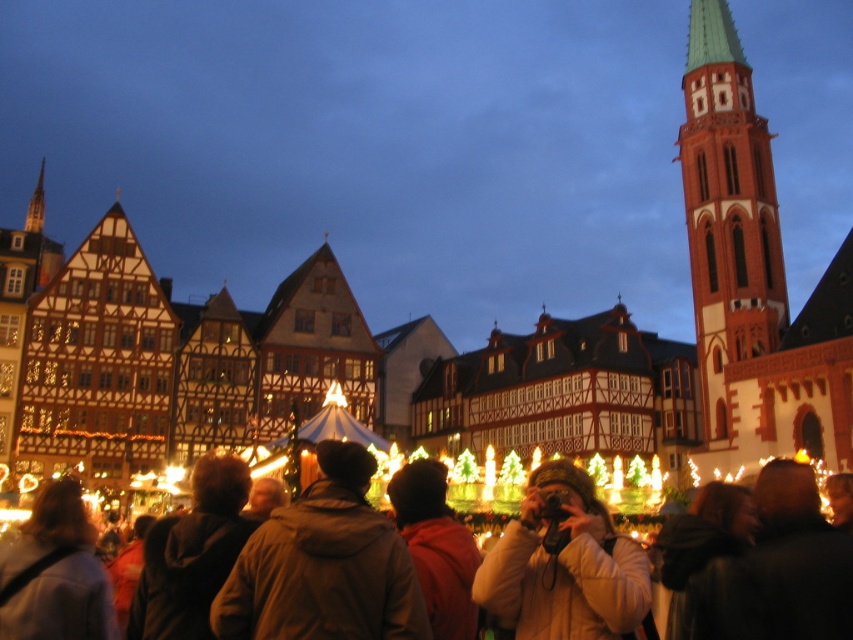
Question: Can you confirm if brown leather jacket at lower left is positioned to the right of brown leather jacket at center?

Choices:
 (A) yes
 (B) no

Answer: (B)

Question: Which object is positioned closest to the brown leather jacket at lower left?

Choices:
 (A) red brick tower at upper right
 (B) brown fuzzy jacket at center
 (C) white fluffy coat at center

Answer: (B)

Question: Which point is closer to the camera taking this photo?

Choices:
 (A) (326, 531)
 (B) (532, 573)
 (C) (701, 456)

Answer: (A)

Question: Can you confirm if red brick tower at upper right is positioned to the right of brown leather jacket at center?

Choices:
 (A) no
 (B) yes

Answer: (B)

Question: Based on their relative distances, which object is nearer to the brown leather jacket at lower left?

Choices:
 (A) brown leather jacket at center
 (B) red jacket at center
 (C) red brick tower at upper right
 (D) white fluffy coat at center

Answer: (B)

Question: Is white fluffy coat at center wider than brown leather jacket at center?

Choices:
 (A) no
 (B) yes

Answer: (A)